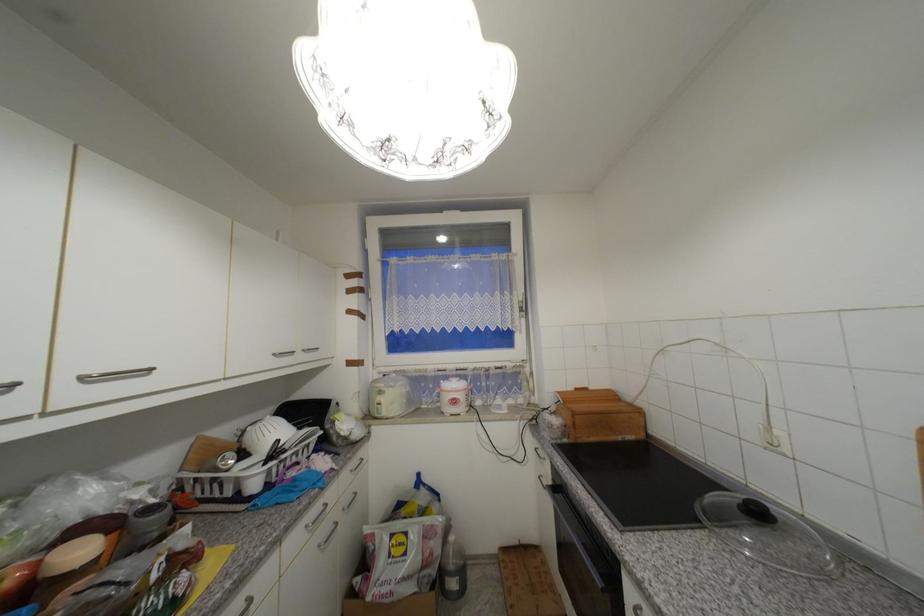
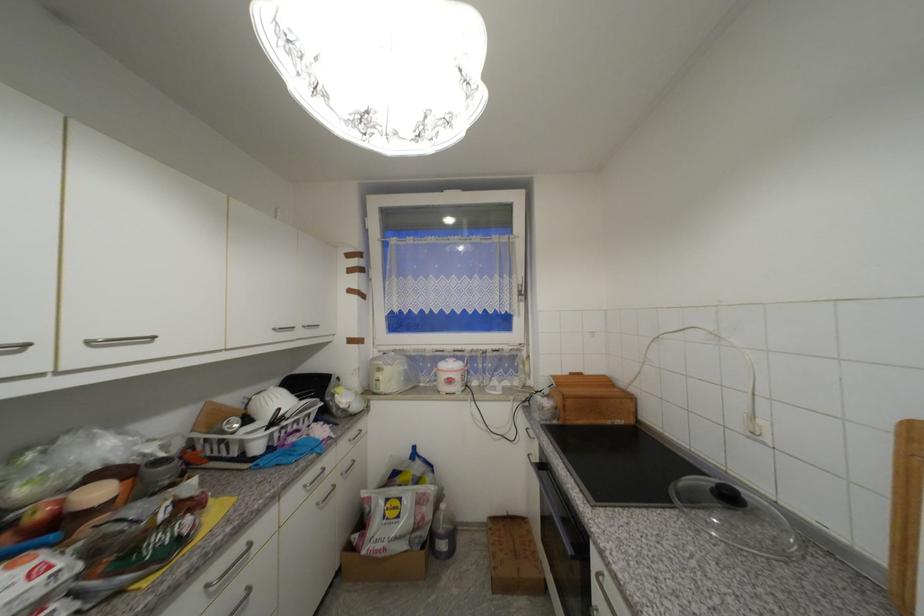
Question: In a continuous first-person perspective shot, in which direction is the camera moving?

Choices:
 (A) Left
 (B) Right
 (C) Forward
 (D) Backward

Answer: (B)